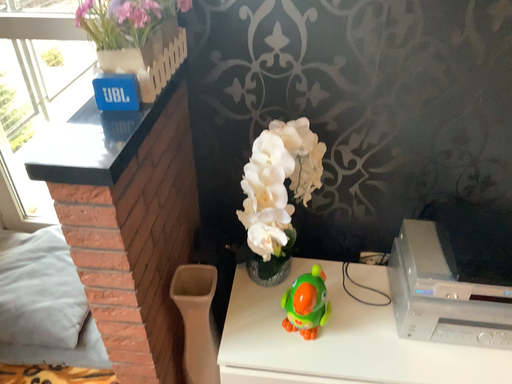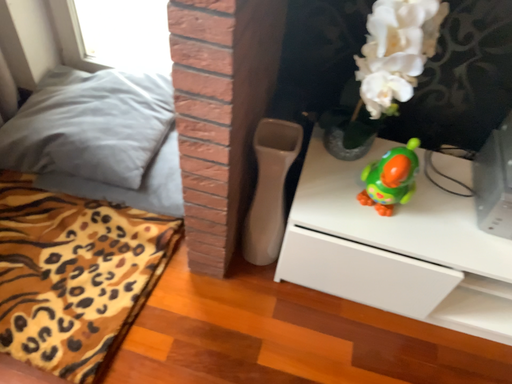
Question: Which way did the camera rotate in the video?

Choices:
 (A) rotated upward
 (B) rotated downward

Answer: (B)